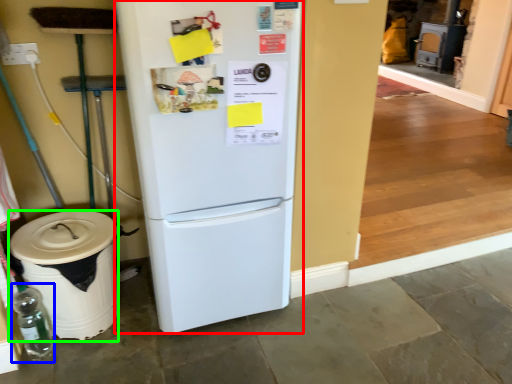
Question: Considering the real-world distances, which object is closest to refrigerator (highlighted by a red box)? bottle (highlighted by a blue box) or trash bin/can (highlighted by a green box).

Choices:
 (A) bottle
 (B) trash bin/can

Answer: (B)